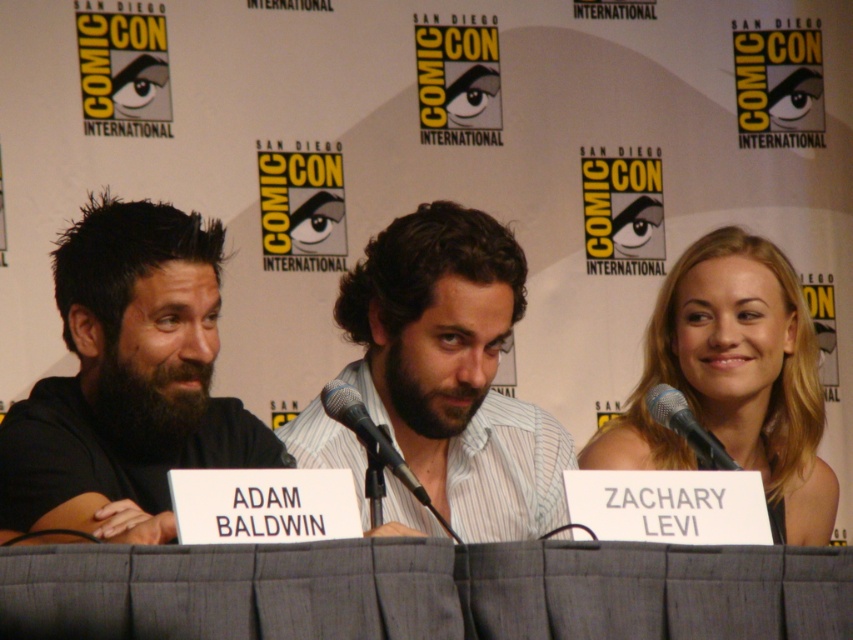
You are a photographer at the event and need to capture a clear shot of both the gray pleated fabric at center and the silver metallic microphone at center. Which object is taller so that it might block the view of the other?

The silver metallic microphone at center is taller than the gray pleated fabric at center, so it might block the view of the gray pleated fabric at center.

You are a photographer at the event and want to capture a closeup of the dark brown hair at left. Where should you focus your camera?

The dark brown hair at left is located at point 0.594 on the x axis and 0.150 on the y axis, so focus your camera there.

You are a photographer at the event and need to capture a clear shot of both the dark brown hair at left and the blonde hair at right. Based on their positions, which hair color should you focus on first to ensure both are in frame?

The dark brown hair at left is located below the blonde hair at right, so you should focus on the blonde hair at right first to ensure both are in frame.